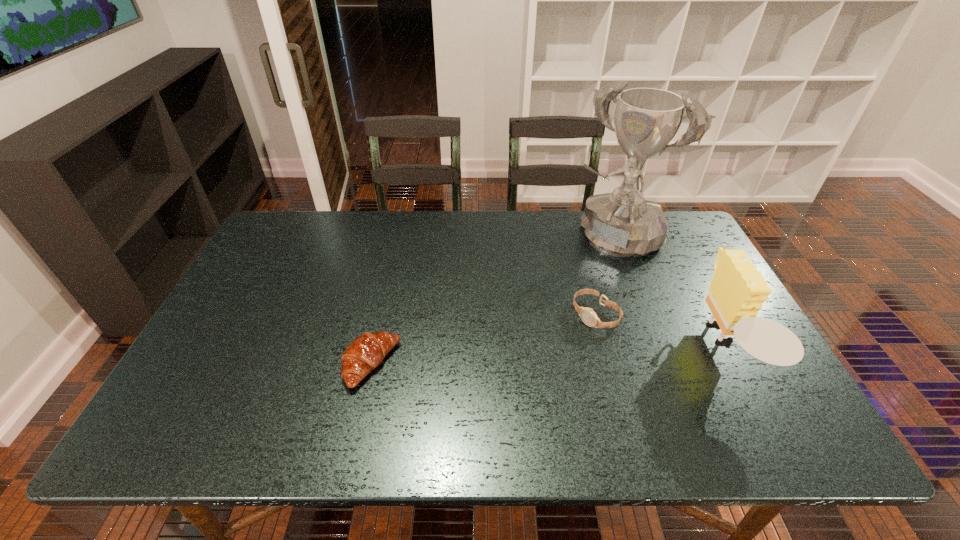
Find the location of a particular element. Image resolution: width=960 pixels, height=540 pixels. free spot on the desktop that is between the leftmost object and the sponge and is positioned on the side with emblem of the farthest object is located at coordinates (510, 357).

What are the coordinates of `free space on the desktop that is between the leftmost object and the second tallest object and is positioned on the face of the watch` in the screenshot? It's located at pyautogui.click(x=539, y=356).